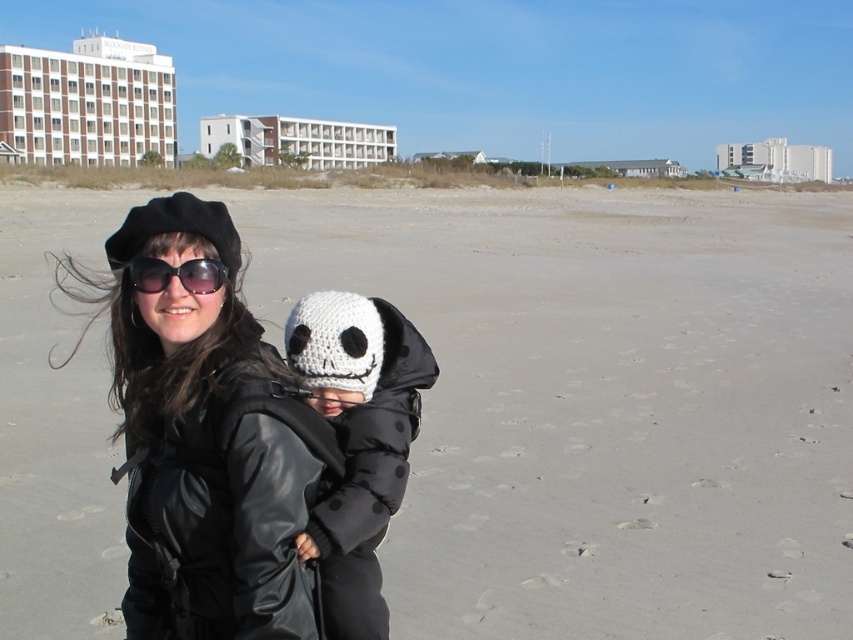
You are a photographer trying to capture a clear shot of both the matte black jacket at center and the white knitted hat at center in the beach scene. Since you want to ensure both are fully visible, which object should you focus on first to account for their size difference?

The matte black jacket at center is taller than the white knitted hat at center, so you should focus on the matte black jacket at center first as it is larger and may require more attention to ensure it is fully in frame.